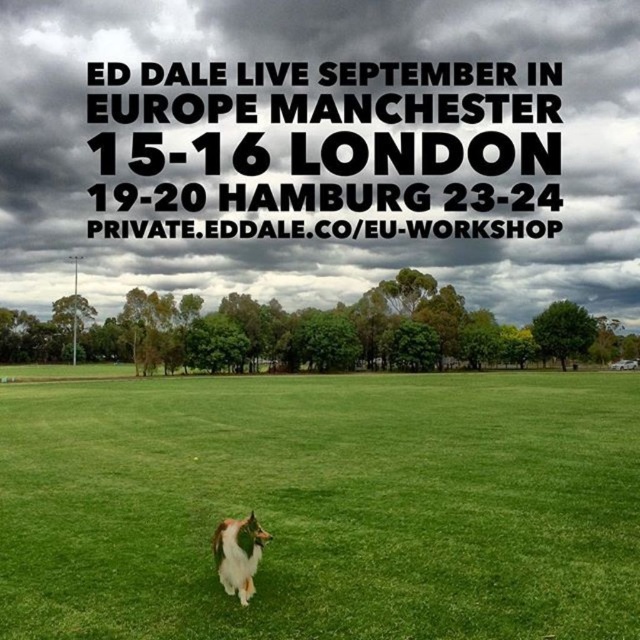
Question: Which of the following is the closest to the observer?

Choices:
 (A) white fluffy dog at lower center
 (B) green grass at center

Answer: (B)

Question: Does green grass at center have a smaller size compared to white fluffy dog at lower center?

Choices:
 (A) no
 (B) yes

Answer: (A)

Question: Which point appears farthest from the camera in this image?

Choices:
 (A) (253, 531)
 (B) (280, 589)

Answer: (B)

Question: Does green grass at center appear on the right side of white fluffy dog at lower center?

Choices:
 (A) yes
 (B) no

Answer: (A)

Question: Is the position of green grass at center more distant than that of white fluffy dog at lower center?

Choices:
 (A) no
 (B) yes

Answer: (A)

Question: Which object appears closest to the camera in this image?

Choices:
 (A) green grass at center
 (B) white fluffy dog at lower center

Answer: (A)